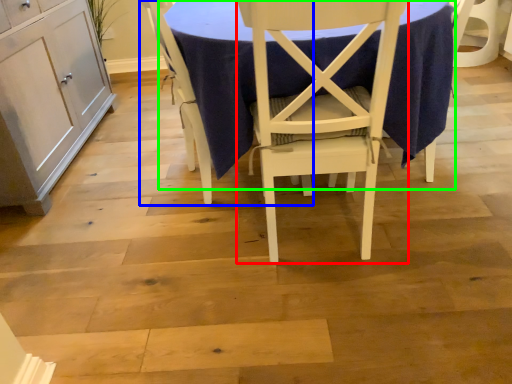
Question: Which object is positioned closest to chair (highlighted by a red box)? Select from chair (highlighted by a blue box) and table (highlighted by a green box).

Choices:
 (A) chair
 (B) table

Answer: (B)